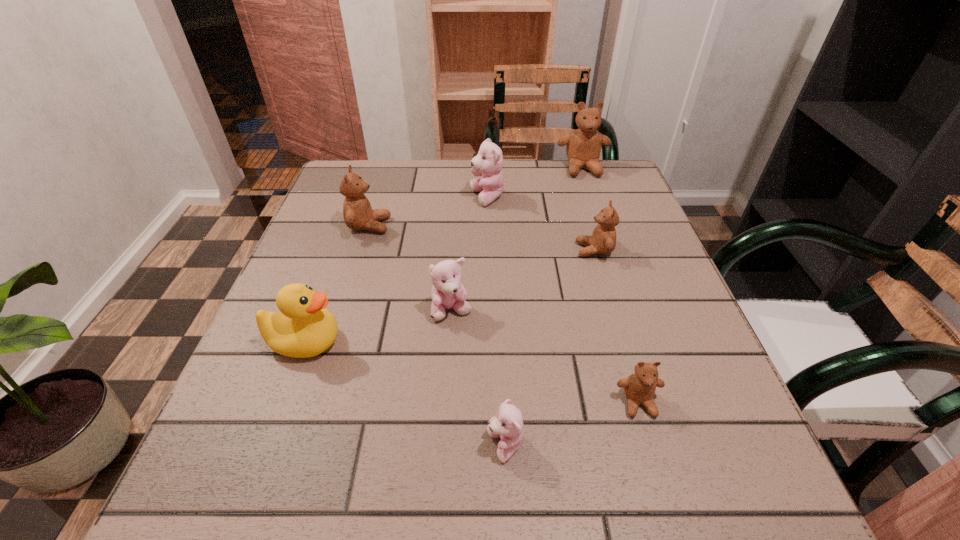
This screenshot has width=960, height=540. Identify the location of the smallest brown teddy bear. (640, 387).

Locate an element on the screen. The image size is (960, 540). the seventh farthest object is located at coordinates (640, 387).

The width and height of the screenshot is (960, 540). What are the coordinates of `the nearest pink teddy bear` in the screenshot? It's located at (508, 423).

Find the location of `the smallest pink teddy bear`. the smallest pink teddy bear is located at coordinates [508, 423].

This screenshot has height=540, width=960. I want to click on vacant area situated on the face of the tallest teddy bear, so click(593, 199).

Locate an element on the screen. free space located 0.150m at the face of the second farthest object is located at coordinates (412, 198).

Locate an element on the screen. free location located at the face of the second farthest object is located at coordinates (334, 198).

Where is `free space located at the face of the second farthest object`? The image size is (960, 540). free space located at the face of the second farthest object is located at coordinates (369, 198).

You are a GUI agent. You are given a task and a screenshot of the screen. Output one action in this format:
    pyautogui.click(x=<x>, y=<y>)
    Task: Click on the vacant space located 0.400m on the face of the leftmost teddy bear
    
    Given the screenshot: What is the action you would take?
    pyautogui.click(x=557, y=226)

You are a GUI agent. You are given a task and a screenshot of the screen. Output one action in this format:
    pyautogui.click(x=<x>, y=<y>)
    Task: Click on the free location located at the beak of the duck
    
    Given the screenshot: What is the action you would take?
    pyautogui.click(x=374, y=342)